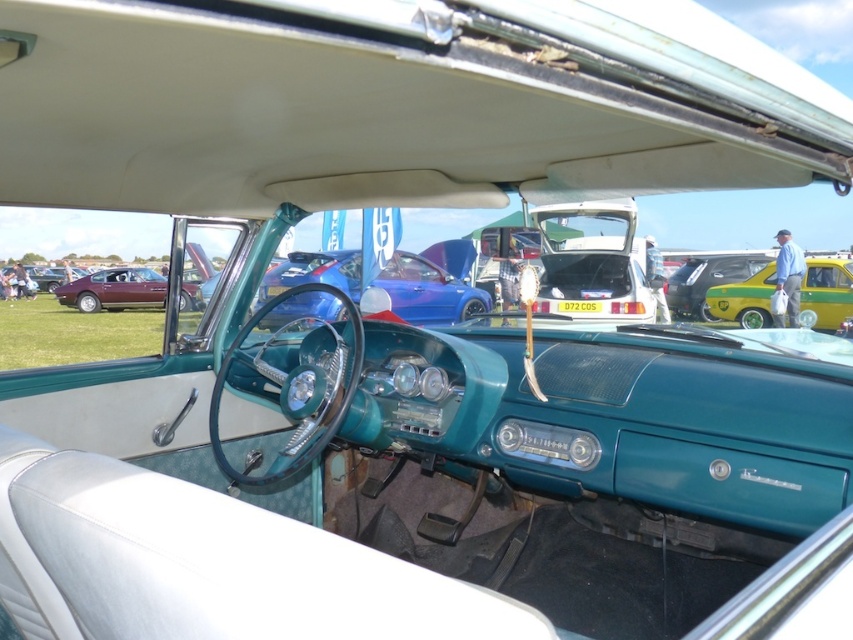
Does blue metallic steering wheel at center have a lesser height compared to yellow-green metallic hatchback at center-right?

Yes.

Who is shorter, blue metallic steering wheel at center or yellow-green metallic hatchback at center-right?

Standing shorter between the two is blue metallic steering wheel at center.

Which is in front, point (399, 289) or point (682, 266)?

Point (399, 289) is in front.

Locate an element on the screen. The image size is (853, 640). blue metallic steering wheel at center is located at coordinates (428, 291).

Is blue metallic steering wheel at center positioned in front of shiny maroon car at left?

No, it is behind shiny maroon car at left.

Is blue metallic steering wheel at center shorter than shiny maroon car at left?

Yes, blue metallic steering wheel at center is shorter than shiny maroon car at left.

Locate an element on the screen. This screenshot has height=640, width=853. blue metallic steering wheel at center is located at coordinates (428, 291).

Locate an element on the screen. blue metallic steering wheel at center is located at coordinates [x=428, y=291].

Is blue metallic steering wheel at center below yellow matte car at right?

Indeed, blue metallic steering wheel at center is positioned under yellow matte car at right.

Between point (358, 296) and point (834, 298), which one is positioned in front?

Point (358, 296)

The image size is (853, 640). What are the coordinates of `blue metallic steering wheel at center` in the screenshot? It's located at (428, 291).